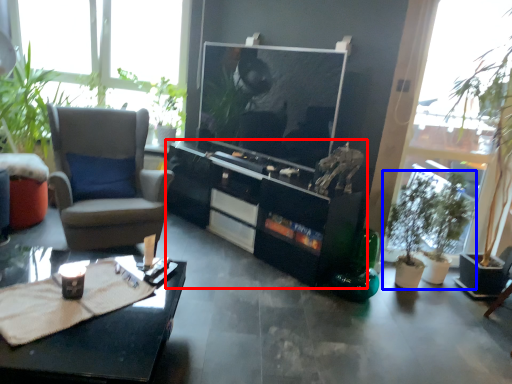
Question: Among these objects, which one is nearest to the camera, cabinetry (highlighted by a red box) or houseplant (highlighted by a blue box)?

Choices:
 (A) cabinetry
 (B) houseplant

Answer: (A)